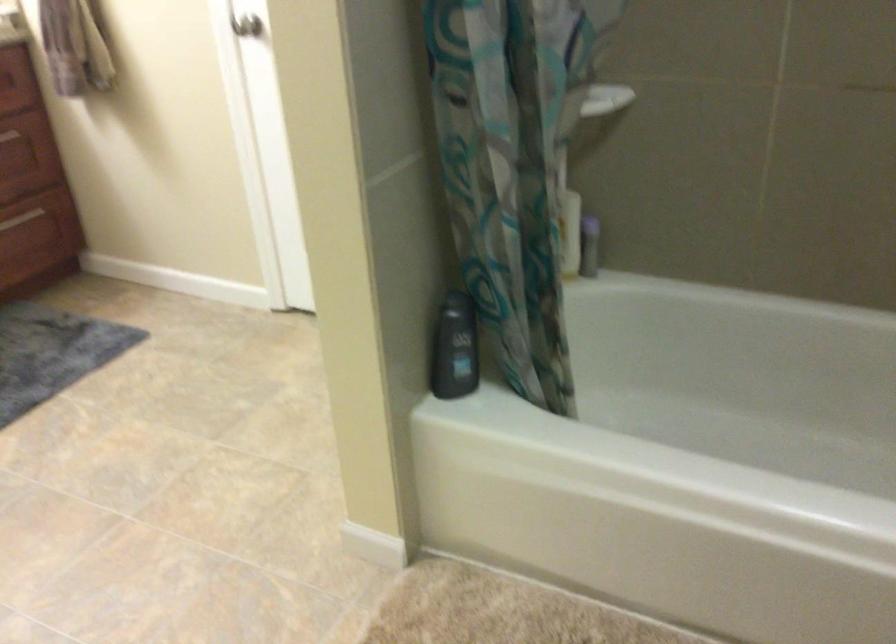
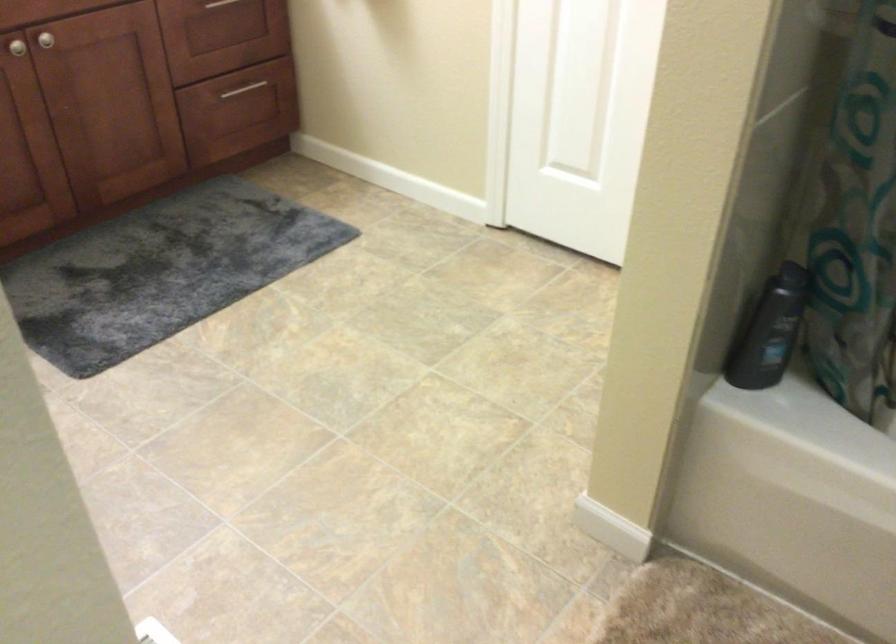
In a continuous first-person perspective shot, in which direction is the camera moving?

The movement direction of the cameraman is left, forward.